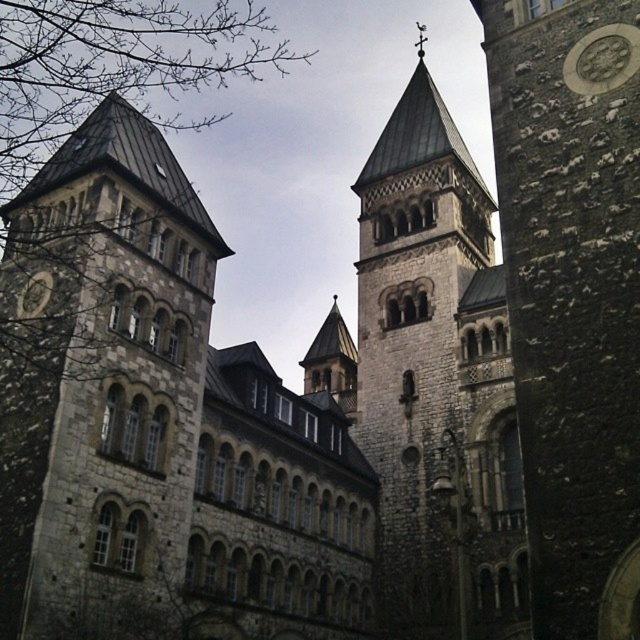
You are an architect analyzing the symmetry of the building. Given that the stone textured tower at center and the silver metallic clock at upper right are both on the facade, which one has a greater width?

The stone textured tower at center has a greater width than the silver metallic clock at upper right.

You are an architect evaluating the design of this Gothic Revival building. You need to determine which of the two towers, the rough stone clock tower at right or the stone textured tower at center, is smaller in overall size. Based on the provided information, which tower is smaller?

The rough stone clock tower at right occupies less space than the stone textured tower at center, so the rough stone clock tower at right is the smaller one.

You are an architect examining the cathedral facade. You notice the rough stone clock tower at right and the silver metallic clock at upper right. Which object is located lower in the image?

The rough stone clock tower at right is positioned under the silver metallic clock at upper right, so the rough stone clock tower at right is lower.